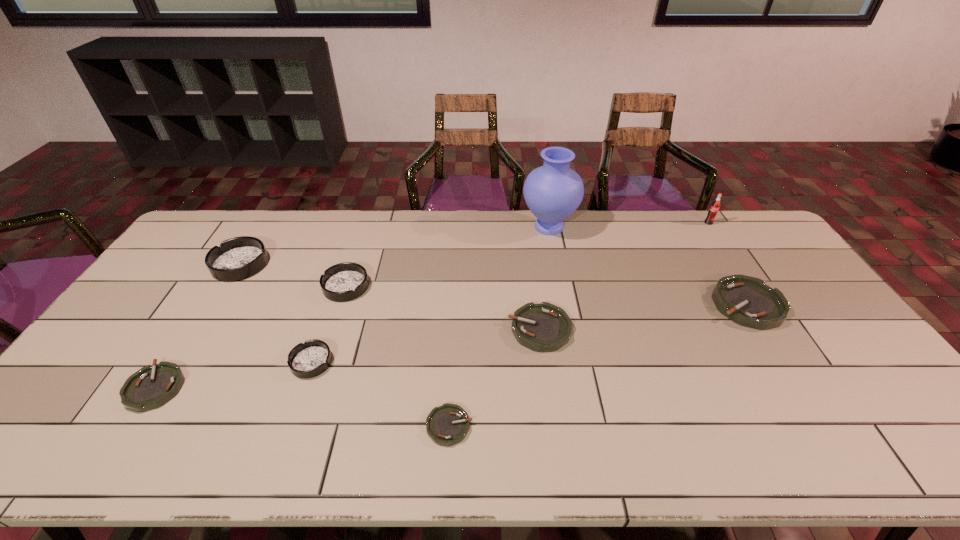
This screenshot has width=960, height=540. In order to click on vacant space located on the front of the third smallest green ashtray in this screenshot , I will do `click(546, 377)`.

The width and height of the screenshot is (960, 540). What are the coordinates of `vacant space situated on the back of the smallest dark ashtray` in the screenshot? It's located at (343, 272).

Where is `blank area located 0.370m on the back of the sixth tallest ashtray`? The height and width of the screenshot is (540, 960). blank area located 0.370m on the back of the sixth tallest ashtray is located at coordinates (228, 272).

Identify the location of vacant area situated on the right of the shortest object. click(x=549, y=426).

I want to click on vase at the far edge, so click(552, 192).

The width and height of the screenshot is (960, 540). I want to click on soda bottle located in the far edge section of the desktop, so click(x=715, y=206).

The image size is (960, 540). Find the location of `ashtray at the far edge`. ashtray at the far edge is located at coordinates (238, 258).

Where is `object that is at the near edge`? The width and height of the screenshot is (960, 540). object that is at the near edge is located at coordinates (446, 425).

Locate an element on the screen. This screenshot has width=960, height=540. object that is positioned at the right edge is located at coordinates (748, 301).

You are a GUI agent. You are given a task and a screenshot of the screen. Output one action in this format:
    pyautogui.click(x=<x>, y=<y>)
    Task: Click on the object positioned at the far left corner
    
    Given the screenshot: What is the action you would take?
    pyautogui.click(x=238, y=258)